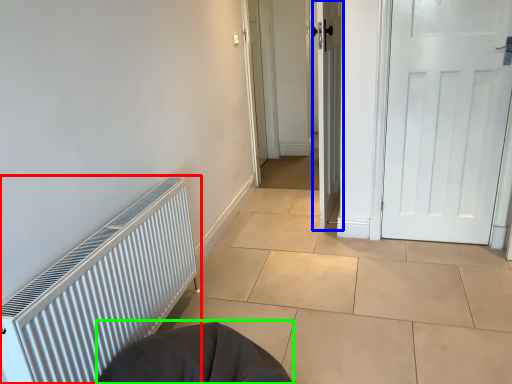
Question: Considering the real-world distances, which object is closest to radiator (highlighted by a red box)? door (highlighted by a blue box) or sleeping bag (highlighted by a green box).

Choices:
 (A) door
 (B) sleeping bag

Answer: (B)